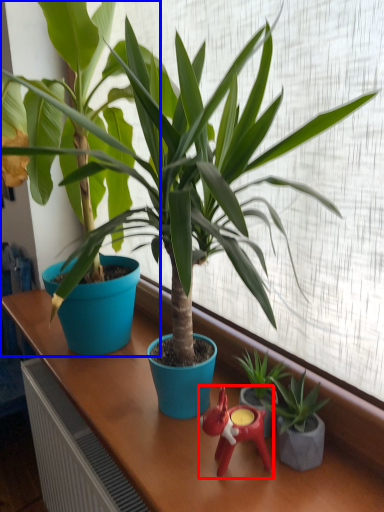
Question: Among these objects, which one is nearest to the camera, miniature (highlighted by a red box) or houseplant (highlighted by a blue box)?

Choices:
 (A) miniature
 (B) houseplant

Answer: (B)